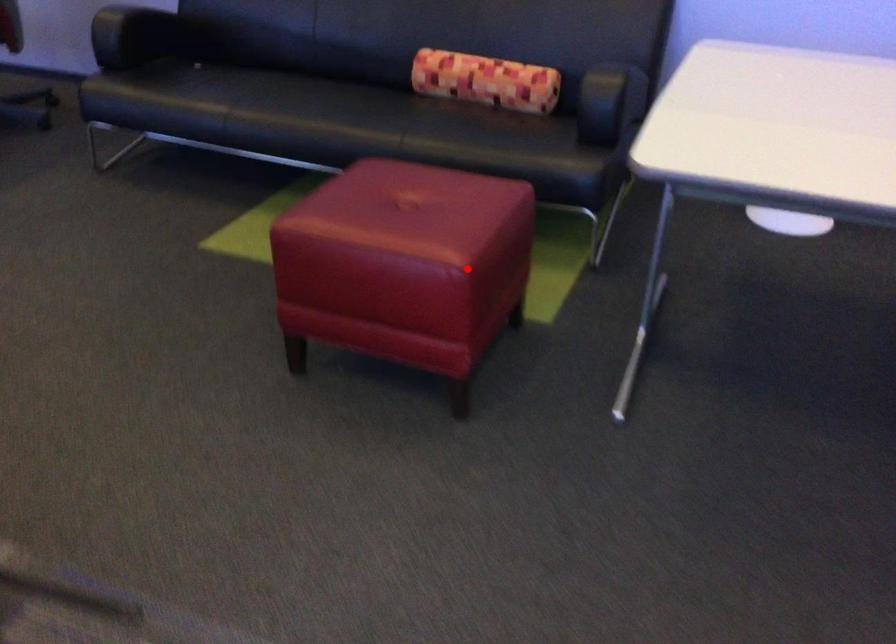
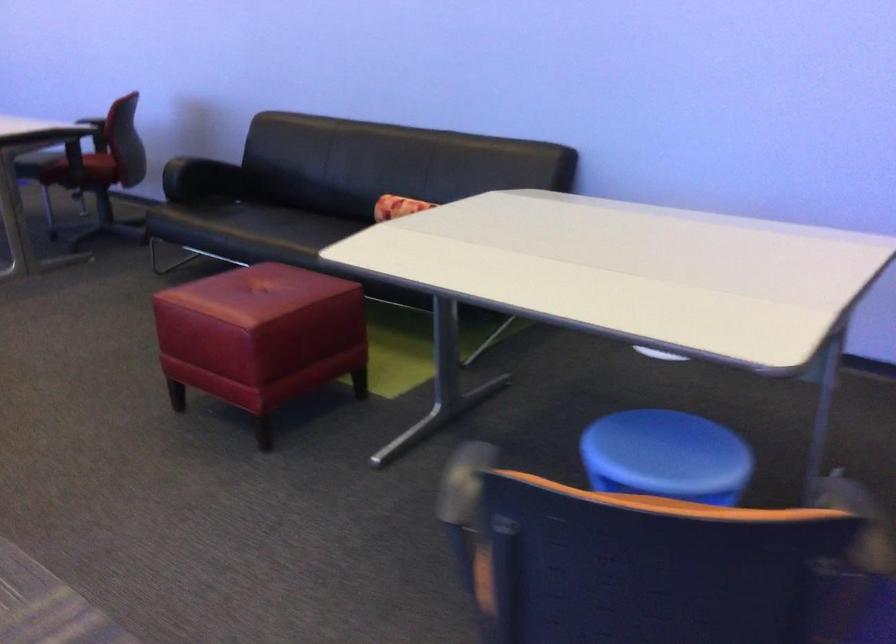
Question: I am providing you with two images of the same scene from different viewpoints. Image1 has a red point marked. In image2, the corresponding 3D location appears at what relative position? Reply with the corresponding letter.

Choices:
 (A) Closer
 (B) Farther

Answer: (B)